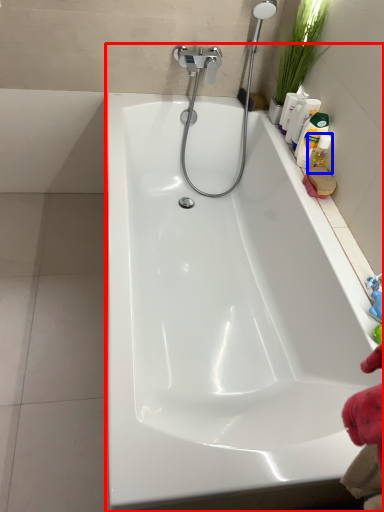
Question: Which object is closer to the camera taking this photo, bathtub (highlighted by a red box) or cleaning product (highlighted by a blue box)?

Choices:
 (A) bathtub
 (B) cleaning product

Answer: (A)